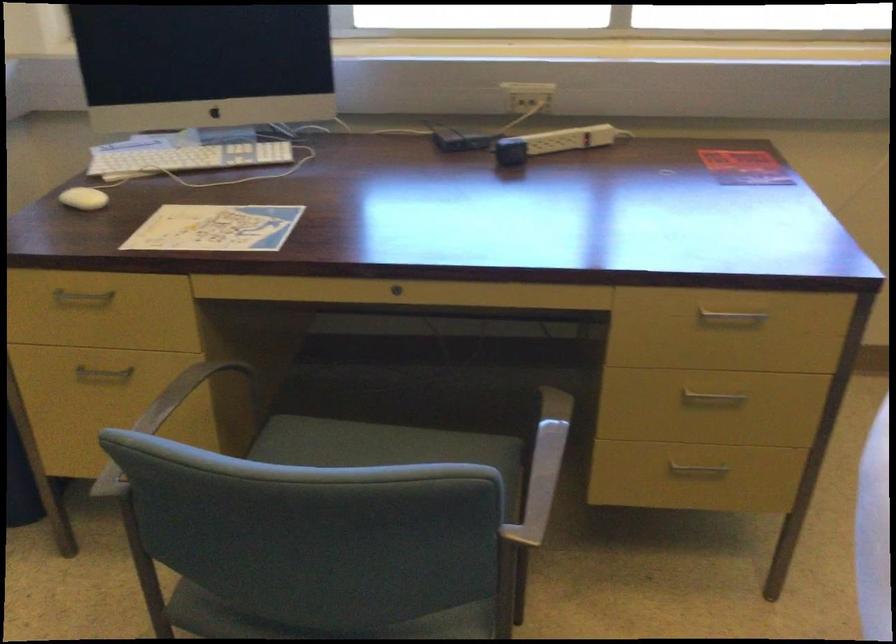
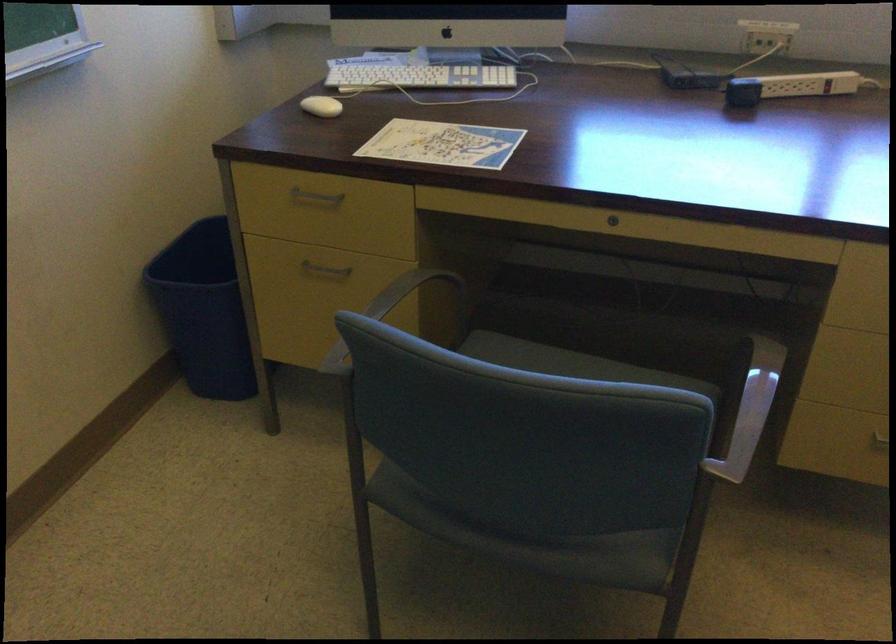
Find the pixel in the second image that matches [107,373] in the first image.

(324, 269)